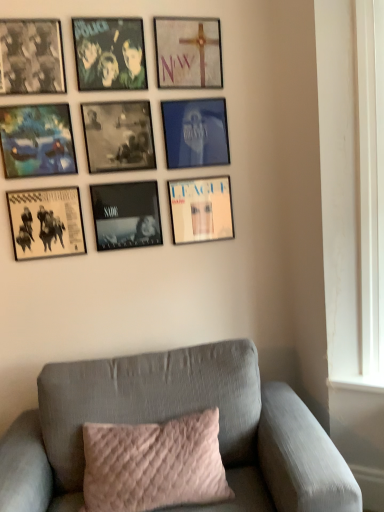
Question: Considering the relative sizes of black matte picture frame at center, the 5th picture frame from the top, and matte white cross at upper center, the 1th picture frame viewed from the top, in the image provided, is black matte picture frame at center, the 5th picture frame from the top, wider than matte white cross at upper center, the 1th picture frame viewed from the top,?

Choices:
 (A) no
 (B) yes

Answer: (B)

Question: Is black matte picture frame at center, the 5th picture frame from the top, shorter than matte white cross at upper center, the 1th picture frame viewed from the top?

Choices:
 (A) no
 (B) yes

Answer: (B)

Question: From the image's perspective, is black matte picture frame at center, the 5th picture frame from the top, beneath matte white cross at upper center, the 1th picture frame viewed from the top?

Choices:
 (A) no
 (B) yes

Answer: (B)

Question: Does black matte picture frame at center, the 5th picture frame from the top, have a greater height compared to matte white cross at upper center, acting as the 9th picture frame starting from the bottom?

Choices:
 (A) yes
 (B) no

Answer: (B)

Question: From a real-world perspective, is black matte picture frame at center, the fifth picture frame from the bottom, located higher than matte white cross at upper center, acting as the 9th picture frame starting from the bottom?

Choices:
 (A) no
 (B) yes

Answer: (A)

Question: Is black matte picture frame at center, the 5th picture frame from the top, spatially inside blue glossy picture frame at upper center, marked as the 6th picture frame in a bottom-to-top arrangement, or outside of it?

Choices:
 (A) outside
 (B) inside

Answer: (A)

Question: Based on their sizes in the image, would you say black matte picture frame at center, the 5th picture frame from the top, is bigger or smaller than blue glossy picture frame at upper center, marked as the 6th picture frame in a bottom-to-top arrangement?

Choices:
 (A) small
 (B) big

Answer: (B)

Question: From a real-world perspective, is black matte picture frame at center, the fifth picture frame from the bottom, above or below blue glossy picture frame at upper center, which is counted as the 4th picture frame, starting from the top?

Choices:
 (A) above
 (B) below

Answer: (A)

Question: Based on their positions, is black matte picture frame at center, the fifth picture frame from the bottom, located to the left or right of blue glossy picture frame at upper center, marked as the 6th picture frame in a bottom-to-top arrangement?

Choices:
 (A) left
 (B) right

Answer: (A)

Question: Does point pos(6,128) appear closer or farther from the camera than point pos(120,117)?

Choices:
 (A) farther
 (B) closer

Answer: (B)

Question: In the image, is matte blue painting at upper left, which is the fourth picture frame in bottom-to-top order, on the left side or the right side of black matte picture frame at center, the 5th picture frame from the top?

Choices:
 (A) right
 (B) left

Answer: (B)

Question: Looking at the image, does matte blue painting at upper left, the 6th picture frame when ordered from top to bottom, seem bigger or smaller compared to black matte picture frame at center, the fifth picture frame from the bottom?

Choices:
 (A) big
 (B) small

Answer: (A)

Question: Is matte blue painting at upper left, the 6th picture frame when ordered from top to bottom, situated inside black matte picture frame at center, the 5th picture frame from the top, or outside?

Choices:
 (A) outside
 (B) inside

Answer: (A)

Question: In terms of height, does matte blue painting at upper left, which is the fourth picture frame in bottom-to-top order, look taller or shorter compared to black matte picture frame at center, which is counted as the second picture frame, starting from the bottom?

Choices:
 (A) tall
 (B) short

Answer: (A)

Question: Looking at their shapes, would you say matte blue painting at upper left, which is the fourth picture frame in bottom-to-top order, is wider or thinner than black matte picture frame at center, which is counted as the second picture frame, starting from the bottom?

Choices:
 (A) thin
 (B) wide

Answer: (B)